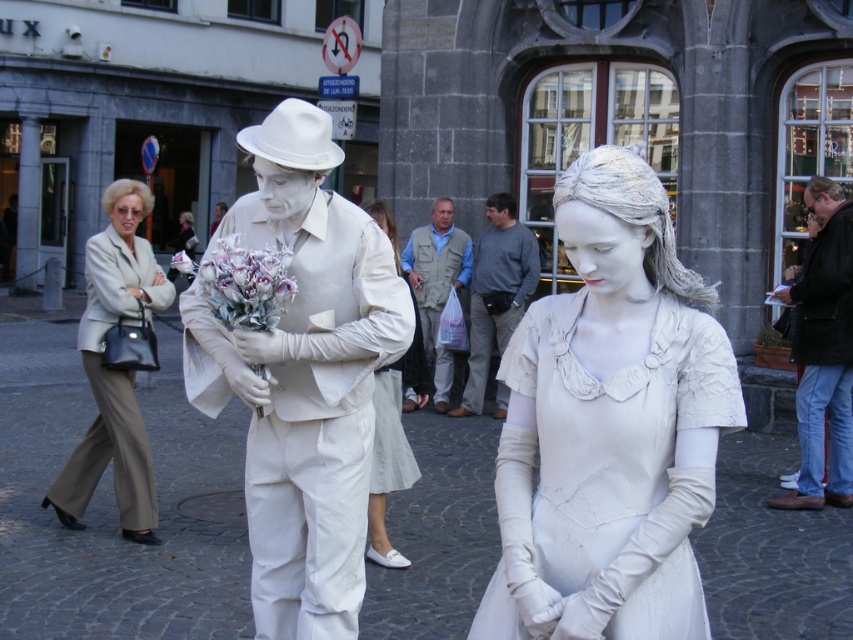
Between white fabric skirt at center and purple silk bouquet at center, which one has more height?

With more height is white fabric skirt at center.

Can you confirm if white fabric skirt at center is positioned above purple silk bouquet at center?

Actually, white fabric skirt at center is below purple silk bouquet at center.

The width and height of the screenshot is (853, 640). Identify the location of white fabric skirt at center. (387, 461).

The image size is (853, 640). I want to click on white fabric skirt at center, so click(x=387, y=461).

Which is more to the right, white matte sculpture at center or light beige vest at center?

From the viewer's perspective, light beige vest at center appears more on the right side.

Does white matte sculpture at center appear on the left side of light beige vest at center?

Indeed, white matte sculpture at center is positioned on the left side of light beige vest at center.

Who is more forward, (x=248, y=221) or (x=451, y=269)?

Point (x=248, y=221)

The image size is (853, 640). I want to click on white matte sculpture at center, so click(303, 378).

Is white matte sculpture at center to the left of white fabric skirt at center from the viewer's perspective?

Yes, white matte sculpture at center is to the left of white fabric skirt at center.

In the scene shown: Who is more distant from viewer, (354, 381) or (373, 209)?

Point (373, 209)

Image resolution: width=853 pixels, height=640 pixels. In order to click on white matte sculpture at center in this screenshot , I will do `click(303, 378)`.